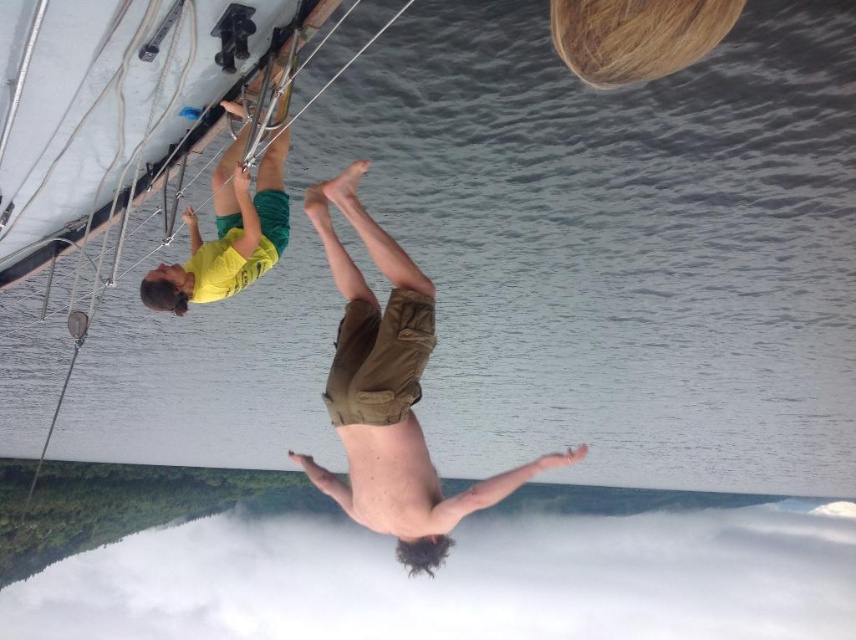
You are a photographer trying to capture both the brown cotton shorts at lower center and the yellow fabric shorts at upper left in the same frame. Which pair of shorts will appear larger in your photo?

The brown cotton shorts at lower center will appear larger in the photo because it is closer to the viewer than the yellow fabric shorts at upper left.

You are a photographer trying to capture the scene of the two people on the boat. Based on the positions of the brown cotton shorts at lower center and the yellow fabric shorts at upper left, which person is closer to the right edge of the photo?

The brown cotton shorts at lower center is positioned on the right side of yellow fabric shorts at upper left, so the person wearing brown cotton shorts at lower center is closer to the right edge of the photo.

You are on a boat and need to retrieve an item. The brown cotton shorts at lower center and the yellow fabric shorts at upper left are both visible. Which item is positioned lower in the image?

The brown cotton shorts at lower center is located below the yellow fabric shorts at upper left, so it is positioned lower in the image.